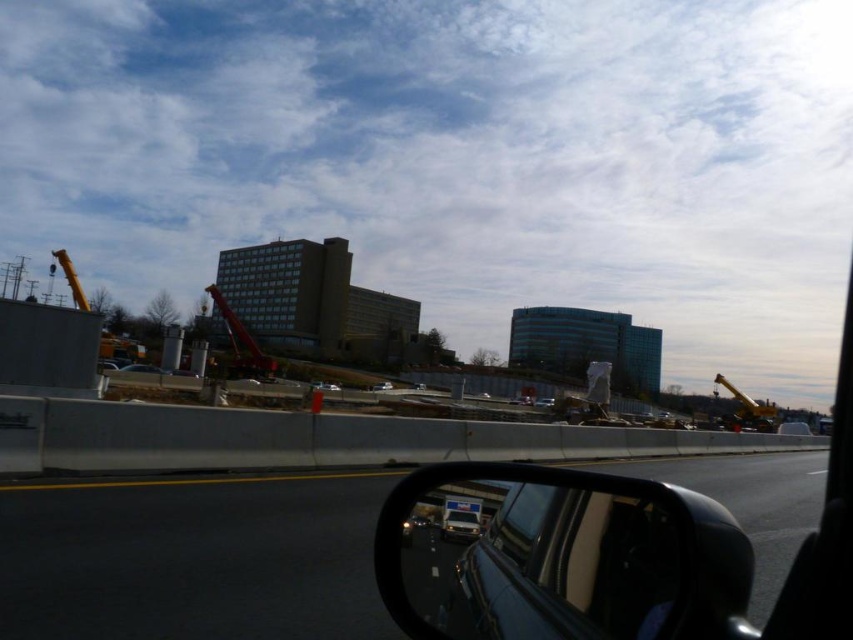
Is metallic red crane at center closer to the viewer compared to yellow metallic crane at right?

No, it is behind yellow metallic crane at right.

Is point (241, 337) closer to camera compared to point (750, 426)?

No, it is behind (750, 426).

The width and height of the screenshot is (853, 640). I want to click on metallic red crane at center, so pos(241,342).

In the scene shown: Is black glossy rearview mirror at lower right to the left of metallic silver car at lower center from the viewer's perspective?

In fact, black glossy rearview mirror at lower right is to the right of metallic silver car at lower center.

Which is more to the left, black glossy rearview mirror at lower right or metallic silver car at lower center?

From the viewer's perspective, metallic silver car at lower center appears more on the left side.

The width and height of the screenshot is (853, 640). I want to click on black glossy rearview mirror at lower right, so coord(560,557).

In order to click on black glossy rearview mirror at lower right in this screenshot , I will do `click(560, 557)`.

Is point (515, 508) farther from viewer compared to point (234, 346)?

No.

Measure the distance between clear glass window at lower right and camera.

1.80 meters

Measure the distance between clear glass window at lower right and camera.

clear glass window at lower right is 5.89 feet away from camera.

The height and width of the screenshot is (640, 853). What are the coordinates of `clear glass window at lower right` in the screenshot? It's located at (524, 524).